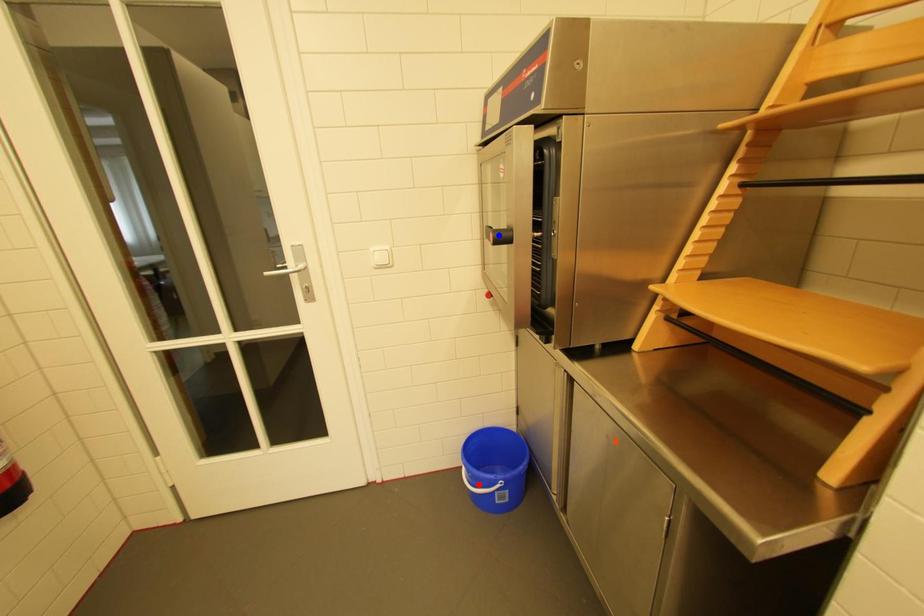
Question: In the image, two points are highlighted. Which point is nearer to the camera? Reply with the corresponding letter.

Choices:
 (A) blue point
 (B) red point

Answer: (A)